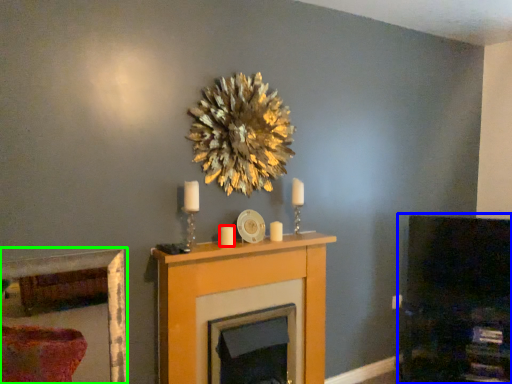
Question: Which object is the farthest from candle (highlighted by a red box)? Choose among these: dark (highlighted by a blue box) or picture frame (highlighted by a green box).

Choices:
 (A) dark
 (B) picture frame

Answer: (B)